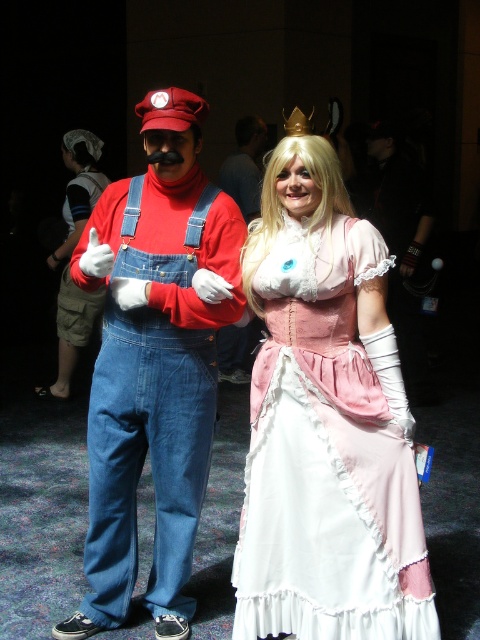
Question: Among these points, which one is farthest from the camera?

Choices:
 (A) [99, 401]
 (B) [360, 422]

Answer: (A)

Question: Does pink satin dress at center appear on the left side of matte denim overalls at left?

Choices:
 (A) no
 (B) yes

Answer: (A)

Question: Can you confirm if pink satin dress at center is positioned below matte denim overalls at left?

Choices:
 (A) yes
 (B) no

Answer: (A)

Question: Is pink satin dress at center further to camera compared to matte denim overalls at left?

Choices:
 (A) yes
 (B) no

Answer: (B)

Question: Among these points, which one is nearest to the camera?

Choices:
 (A) (367, 602)
 (B) (192, 220)

Answer: (A)